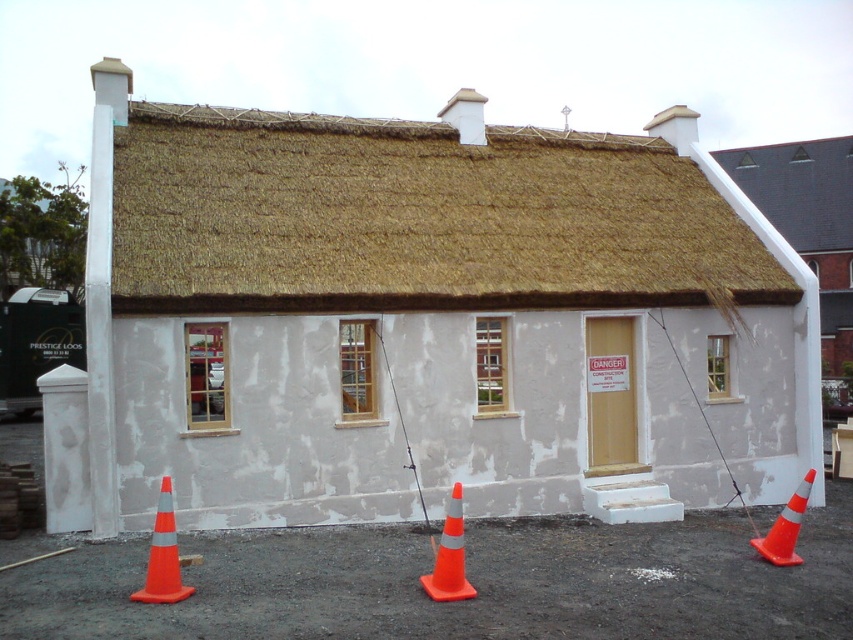
Is brown thatch at center to the right of orange/cone at lower left from the viewer's perspective?

Indeed, brown thatch at center is positioned on the right side of orange/cone at lower left.

Does brown thatch at center appear on the left side of orange/cone at lower left?

No, brown thatch at center is not to the left of orange/cone at lower left.

I want to click on brown thatch at center, so [x=415, y=218].

Is white plastered hut at center to the right of orange/cone at lower center from the viewer's perspective?

Yes, white plastered hut at center is to the right of orange/cone at lower center.

Is point (712, 253) positioned behind point (454, 556)?

Yes.

Is point (102, 266) farther from camera compared to point (456, 586)?

That is True.

This screenshot has height=640, width=853. Identify the location of white plastered hut at center. (422, 321).

Which is more to the left, orange/cone at lower left or orange plastic fishing pole at right?

Positioned to the left is orange/cone at lower left.

Does orange/cone at lower left have a lesser height compared to orange plastic fishing pole at right?

Indeed, orange/cone at lower left has a lesser height compared to orange plastic fishing pole at right.

This screenshot has width=853, height=640. In order to click on orange/cone at lower left in this screenshot , I will do `click(163, 556)`.

Identify the location of orange/cone at lower left. Image resolution: width=853 pixels, height=640 pixels. (163, 556).